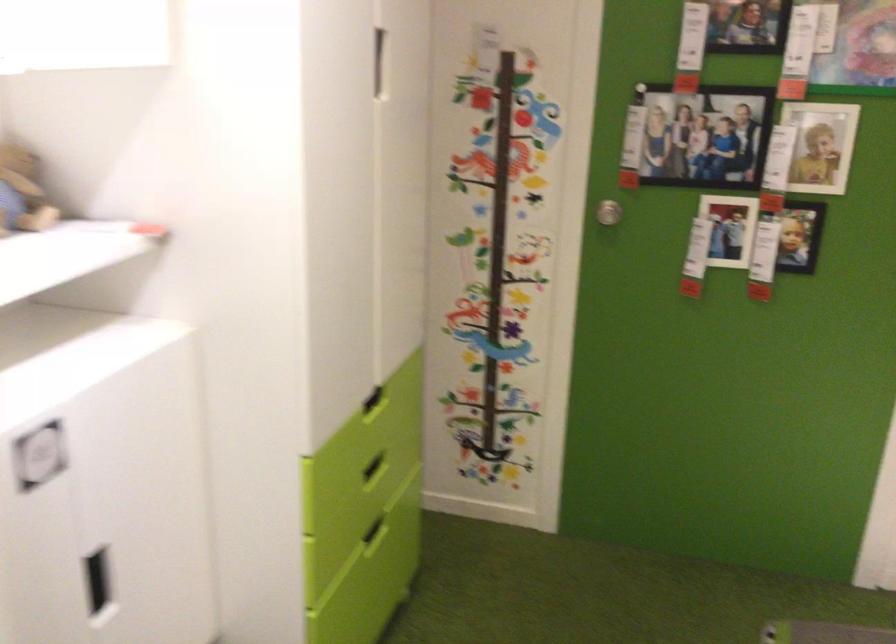
Describe the element at coordinates (607, 212) in the screenshot. I see `the silver door knob` at that location.